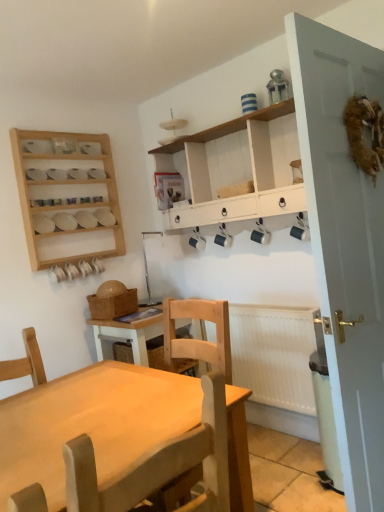
Measure the distance between white matte radiator at lower right and camera.

white matte radiator at lower right and camera are 2.27 meters apart from each other.

Image resolution: width=384 pixels, height=512 pixels. Identify the location of light brown wooden chair at center. (158, 464).

From the picture: Measure the distance between point [144,464] and camera.

Point [144,464] is 35.71 inches away from camera.

The height and width of the screenshot is (512, 384). Identify the location of wooden spice rack at upper left. (64, 193).

Measure the distance between wooden spice rack at upper left and camera.

They are 2.54 meters apart.

Locate an element on the screen. The height and width of the screenshot is (512, 384). white matte radiator at lower right is located at coordinates (275, 354).

From a real-world perspective, is white painted wood cabinet at upper center on top of white painted door at right?

Yes.

Can you confirm if white painted wood cabinet at upper center is bigger than white painted door at right?

No.

Is white painted wood cabinet at upper center far away from white painted door at right?

white painted wood cabinet at upper center is actually quite close to white painted door at right.

Considering the sizes of objects white painted wood cabinet at upper center and white painted door at right in the image provided, who is shorter, white painted wood cabinet at upper center or white painted door at right?

With less height is white painted wood cabinet at upper center.

Does light brown wooden chair at center have a greater width compared to white painted wood cabinet at upper center?

Indeed, light brown wooden chair at center has a greater width compared to white painted wood cabinet at upper center.

Between light brown wooden chair at center and white painted wood cabinet at upper center, which one is positioned behind?

white painted wood cabinet at upper center is more distant.

From a real-world perspective, is light brown wooden chair at center on top of white painted wood cabinet at upper center?

Actually, light brown wooden chair at center is physically below white painted wood cabinet at upper center in the real world.

Would you consider light brown wooden chair at center to be distant from white painted wood cabinet at upper center?

Yes, light brown wooden chair at center and white painted wood cabinet at upper center are quite far apart.

Does point (350, 70) lie behind point (227, 452)?

Yes.

The image size is (384, 512). Find the location of `door above the light brown wooden chair at center (from a real-world perspective)`. door above the light brown wooden chair at center (from a real-world perspective) is located at coordinates (344, 243).

Between white painted door at right and light brown wooden chair at center, which one has larger width?

With larger width is light brown wooden chair at center.

This screenshot has height=512, width=384. Find the location of `cabinetry above the light brown wooden chair at center (from a real-world perspective)`. cabinetry above the light brown wooden chair at center (from a real-world perspective) is located at coordinates (240, 169).

Is white painted wood cabinet at upper center wider or thinner than light brown wooden chair at center?

Considering their sizes, white painted wood cabinet at upper center looks slimmer than light brown wooden chair at center.

Is white painted wood cabinet at upper center at the right side of light brown wooden chair at center?

Correct, you'll find white painted wood cabinet at upper center to the right of light brown wooden chair at center.

Is white painted wood cabinet at upper center in front of or behind light brown wooden chair at center in the image?

Visually, white painted wood cabinet at upper center is located behind light brown wooden chair at center.

Which of these two, white painted door at right or white painted wood cabinet at upper center, is wider?

white painted wood cabinet at upper center is wider.

Considering the sizes of objects white painted door at right and white painted wood cabinet at upper center in the image provided, who is bigger, white painted door at right or white painted wood cabinet at upper center?

Bigger between the two is white painted door at right.

From the image's perspective, which one is positioned lower, white painted door at right or white painted wood cabinet at upper center?

white painted door at right.

Can you confirm if white painted door at right is shorter than white painted wood cabinet at upper center?

In fact, white painted door at right may be taller than white painted wood cabinet at upper center.

Which of these two, wooden spice rack at upper left or light brown wooden chair at center, stands shorter?

light brown wooden chair at center.

Is point (21, 207) closer or farther from the camera than point (203, 389)?

Point (21, 207) is farther from the camera than point (203, 389).

Considering the sizes of wooden spice rack at upper left and light brown wooden chair at center in the image, is wooden spice rack at upper left wider or thinner than light brown wooden chair at center?

In the image, wooden spice rack at upper left appears to be more narrow than light brown wooden chair at center.

How distant is wooden spice rack at upper left from light brown wooden chair at center?

A distance of 1.94 meters exists between wooden spice rack at upper left and light brown wooden chair at center.

Is wooden spice rack at upper left not near white matte radiator at lower right?

wooden spice rack at upper left is positioned a significant distance from white matte radiator at lower right.

From a real-world perspective, who is located lower, wooden spice rack at upper left or white matte radiator at lower right?

white matte radiator at lower right.

Image resolution: width=384 pixels, height=512 pixels. Find the location of `shelf lying above the white matte radiator at lower right (from the image's perspective)`. shelf lying above the white matte radiator at lower right (from the image's perspective) is located at coordinates (64, 193).

Can you confirm if wooden spice rack at upper left is positioned to the right of white matte radiator at lower right?

Incorrect, wooden spice rack at upper left is not on the right side of white matte radiator at lower right.

Locate an element on the screen. This screenshot has height=512, width=384. cabinetry behind the white painted door at right is located at coordinates (240, 169).

Find the location of a particular element. chair in front of the white painted wood cabinet at upper center is located at coordinates (158, 464).

From the image, which object appears to be nearer to light brown wooden chair at center, wooden spice rack at upper left or white painted wood cabinet at upper center?

white painted wood cabinet at upper center.

Estimate the real-world distances between objects in this image. Which object is closer to white matte radiator at lower right, white painted wood cabinet at upper center or white painted door at right?

white painted wood cabinet at upper center is positioned closer to the anchor white matte radiator at lower right.

Estimate the real-world distances between objects in this image. Which object is closer to white painted wood cabinet at upper center, white painted door at right or light brown wooden chair at center?

Among the two, white painted door at right is located nearer to white painted wood cabinet at upper center.

Considering their positions, is white matte radiator at lower right positioned further to wooden spice rack at upper left than light brown wooden chair at center?

light brown wooden chair at center lies further to wooden spice rack at upper left than the other object.

Based on their spatial positions, is wooden spice rack at upper left or white painted door at right closer to light brown wooden chair at center?

white painted door at right is positioned closer to the anchor light brown wooden chair at center.

Estimate the real-world distances between objects in this image. Which object is further from white painted door at right, white painted wood cabinet at upper center or white matte radiator at lower right?

white matte radiator at lower right is further to white painted door at right.

Considering their positions, is wooden spice rack at upper left positioned closer to white painted wood cabinet at upper center than white painted door at right?

wooden spice rack at upper left.

Estimate the real-world distances between objects in this image. Which object is closer to white painted wood cabinet at upper center, light brown wooden chair at center or white matte radiator at lower right?

Based on the image, white matte radiator at lower right appears to be nearer to white painted wood cabinet at upper center.

Identify the location of cabinetry located between light brown wooden chair at center and wooden spice rack at upper left in the depth direction. Image resolution: width=384 pixels, height=512 pixels. (240, 169).

This screenshot has width=384, height=512. What are the coordinates of `radiator situated between wooden spice rack at upper left and white painted door at right from left to right` in the screenshot? It's located at (275, 354).

Find the location of a particular element. Image resolution: width=384 pixels, height=512 pixels. door located between light brown wooden chair at center and white matte radiator at lower right in the depth direction is located at coordinates (344, 243).

The image size is (384, 512). Identify the location of door between light brown wooden chair at center and white painted wood cabinet at upper center in the front-back direction. (344, 243).